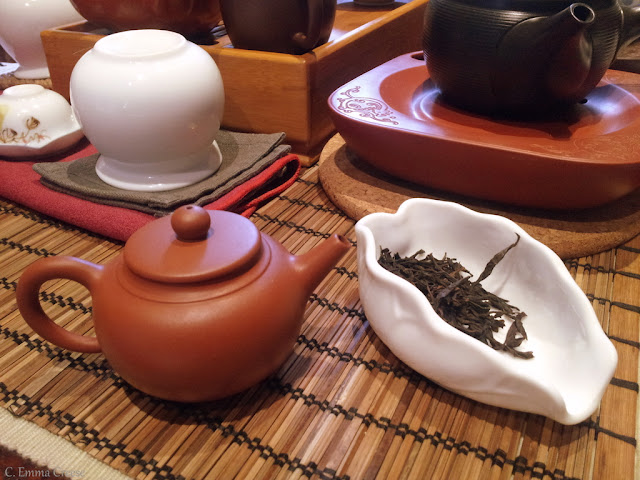
Identify the location of dishes. (431, 345), (154, 132), (38, 114), (26, 8).